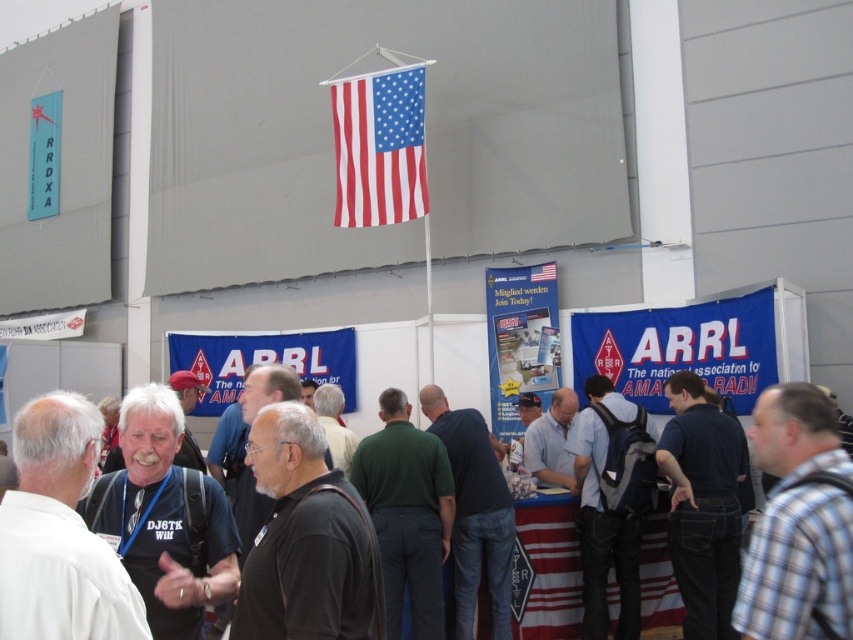
Question: Which of these objects is positioned farthest from the dark blue shirt at center?

Choices:
 (A) blue fabric banner at center
 (B) dark blue backpack at center
 (C) black shirt at center
 (D) american flag at upper center

Answer: (A)

Question: Is black shirt at center smaller than blue fabric banner at center?

Choices:
 (A) yes
 (B) no

Answer: (A)

Question: From the image, what is the correct spatial relationship of plaid fabric shirt at center in relation to dark blue backpack at center?

Choices:
 (A) below
 (B) above

Answer: (B)

Question: Among these points, which one is farthest from the camera?

Choices:
 (A) (734, 502)
 (B) (761, 419)
 (C) (531, 614)

Answer: (C)

Question: Which of the following is the farthest from the observer?

Choices:
 (A) (821, 420)
 (B) (631, 509)
 (C) (219, 397)
 (D) (525, 548)

Answer: (C)

Question: Is dark blue shirt at center to the right of black shirt at center from the viewer's perspective?

Choices:
 (A) no
 (B) yes

Answer: (B)